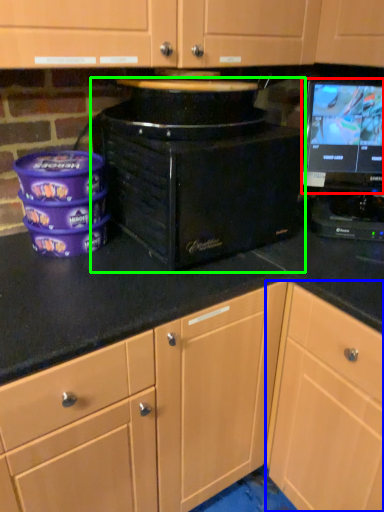
Question: Which is nearer to the computer monitor (highlighted by a red box)? cabinetry (highlighted by a blue box) or home appliance (highlighted by a green box).

Choices:
 (A) cabinetry
 (B) home appliance

Answer: (B)